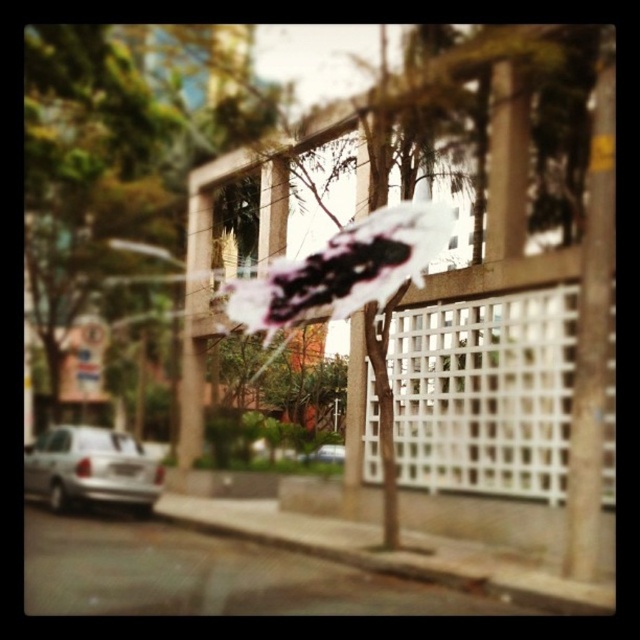
Question: Which object appears closest to the camera in this image?

Choices:
 (A) silver metallic car at center
 (B) silver metallic car at lower left
 (C) white lattice fence at center

Answer: (C)

Question: Which point appears farthest from the camera in this image?

Choices:
 (A) (77, 458)
 (B) (465, 548)
 (C) (609, 442)

Answer: (A)

Question: Does gray concrete curb at lower center lie behind silver metallic car at lower left?

Choices:
 (A) no
 (B) yes

Answer: (A)

Question: Can you confirm if silver metallic car at lower left is positioned above silver metallic car at center?

Choices:
 (A) yes
 (B) no

Answer: (A)

Question: In this image, where is white lattice fence at center located relative to silver metallic car at center?

Choices:
 (A) above
 (B) below

Answer: (A)

Question: Among these points, which one is nearest to the camera?

Choices:
 (A) (93, 429)
 (B) (595, 392)

Answer: (B)